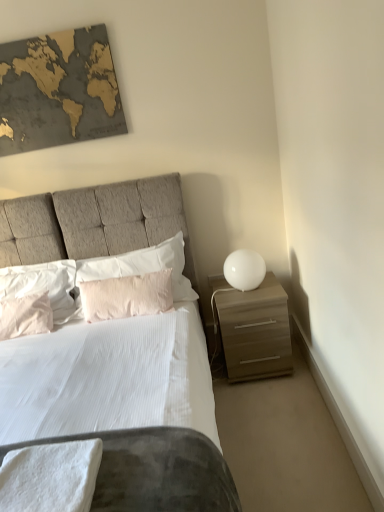
Describe the element at coordinates (98, 221) in the screenshot. The image size is (384, 512). I see `white fabric bed at center` at that location.

Locate an element on the screen. Image resolution: width=384 pixels, height=512 pixels. gold textured map at upper left is located at coordinates (58, 90).

Describe the element at coordinates (126, 296) in the screenshot. I see `pale pink fabric pillow at center, positioned as the second pillow in right-to-left order` at that location.

Identify the location of pale pink fabric pillow at center, which is counted as the third pillow, starting from the left. (126, 296).

Locate an element on the screen. The width and height of the screenshot is (384, 512). matte brown nightstand at right is located at coordinates (255, 331).

The image size is (384, 512). Find the location of `white soft towel at lower left`. white soft towel at lower left is located at coordinates (50, 477).

The image size is (384, 512). What are the coordinates of `white fabric bed at center` in the screenshot? It's located at (98, 221).

Based on the photo, is pale pink fabric pillow at center, which is counted as the third pillow, starting from the left, outside of pink cotton pillow at left, the first pillow from the left?

Indeed, pale pink fabric pillow at center, which is counted as the third pillow, starting from the left, is completely outside pink cotton pillow at left, the first pillow from the left.

From the image's perspective, which one is positioned higher, pale pink fabric pillow at center, which is counted as the third pillow, starting from the left, or pink cotton pillow at left, the first pillow from the left?

pale pink fabric pillow at center, which is counted as the third pillow, starting from the left, appears higher in the image.

Which object is further away from the camera, pale pink fabric pillow at center, which is counted as the third pillow, starting from the left, or pink cotton pillow at left, the first pillow from the left?

pink cotton pillow at left, the first pillow from the left, is behind.

How many degrees apart are the facing directions of pale pink fabric pillow at center, positioned as the second pillow in right-to-left order, and pink cotton pillow at left, the first pillow from the left?

There is a 12.6-degree angle between the facing directions of pale pink fabric pillow at center, positioned as the second pillow in right-to-left order, and pink cotton pillow at left, the first pillow from the left.

Would you say pink cotton pillow at left, the first pillow from the left, is inside or outside white fabric bed at center?

pink cotton pillow at left, the first pillow from the left, is contained in white fabric bed at center.

From a real-world perspective, is pink cotton pillow at left, the 4th pillow in the right-to-left sequence, located higher than white fabric bed at center?

Actually, pink cotton pillow at left, the 4th pillow in the right-to-left sequence, is physically below white fabric bed at center in the real world.

Which is closer to the camera, [32,316] or [131,183]?

Point [32,316] is positioned closer to the camera compared to point [131,183].

From a real-world perspective, is gold textured map at upper left located beneath pale pink fabric pillow at center, which is counted as the third pillow, starting from the left?

Actually, gold textured map at upper left is physically above pale pink fabric pillow at center, which is counted as the third pillow, starting from the left, in the real world.

Does gold textured map at upper left appear on the left side of pale pink fabric pillow at center, positioned as the second pillow in right-to-left order?

Yes, gold textured map at upper left is to the left of pale pink fabric pillow at center, positioned as the second pillow in right-to-left order.

Where is `the 3rd pillow below the gold textured map at upper left (from the image's perspective)`? Image resolution: width=384 pixels, height=512 pixels. the 3rd pillow below the gold textured map at upper left (from the image's perspective) is located at coordinates (126, 296).

Can we say gold textured map at upper left lies outside pale pink fabric pillow at center, positioned as the second pillow in right-to-left order?

Result: Absolutely, gold textured map at upper left is external to pale pink fabric pillow at center, positioned as the second pillow in right-to-left order.

Considering the relative positions of pink cotton pillow at left, the 4th pillow in the right-to-left sequence, and white glossy sphere at right in the image provided, is pink cotton pillow at left, the 4th pillow in the right-to-left sequence, to the right of white glossy sphere at right from the viewer's perspective?

Incorrect, pink cotton pillow at left, the 4th pillow in the right-to-left sequence, is not on the right side of white glossy sphere at right.

From a real-world perspective, which is physically below, pink cotton pillow at left, the 4th pillow in the right-to-left sequence, or white glossy sphere at right?

In real-world perspective, pink cotton pillow at left, the 4th pillow in the right-to-left sequence, is lower.

Based on their sizes in the image, would you say pink cotton pillow at left, the first pillow from the left, is bigger or smaller than white glossy sphere at right?

Considering their sizes, pink cotton pillow at left, the first pillow from the left, takes up more space than white glossy sphere at right.

From a real-world perspective, between pale pink fabric pillow at center, which is counted as the third pillow, starting from the left, and white soft pillow at upper left, the 2th pillow from the left, who is vertically lower?

In real-world perspective, pale pink fabric pillow at center, which is counted as the third pillow, starting from the left, is lower.

Do you think pale pink fabric pillow at center, positioned as the second pillow in right-to-left order, is within white soft pillow at upper left, the third pillow positioned from the right, or outside of it?

pale pink fabric pillow at center, positioned as the second pillow in right-to-left order, is outside white soft pillow at upper left, the third pillow positioned from the right.

The image size is (384, 512). In order to click on pillow that is the 1st object located above the pale pink fabric pillow at center, which is counted as the third pillow, starting from the left (from the image's perspective) in this screenshot , I will do tap(44, 286).

From the image's perspective, is pale pink fabric pillow at center, which is counted as the third pillow, starting from the left, below white soft pillow at upper left, the 2th pillow from the left?

Indeed, from the image's perspective, pale pink fabric pillow at center, which is counted as the third pillow, starting from the left, is shown beneath white soft pillow at upper left, the 2th pillow from the left.

From the image's perspective, is white glossy sphere at right located above or below matte brown nightstand at right?

white glossy sphere at right is above matte brown nightstand at right.

Are white glossy sphere at right and matte brown nightstand at right making contact?

white glossy sphere at right and matte brown nightstand at right are clearly separated.

Between white glossy sphere at right and matte brown nightstand at right, which one has less height?

white glossy sphere at right is shorter.

Which object is wider, white glossy sphere at right or matte brown nightstand at right?

With larger width is matte brown nightstand at right.

Is pink cotton pillow at left, the 4th pillow in the right-to-left sequence, further to the viewer compared to white soft pillow at upper left, the 2th pillow from the left?

No, it is in front of white soft pillow at upper left, the 2th pillow from the left.

From the image's perspective, is pink cotton pillow at left, the 4th pillow in the right-to-left sequence, above white soft pillow at upper left, the 2th pillow from the left?

No, from the image's perspective, pink cotton pillow at left, the 4th pillow in the right-to-left sequence, is not above white soft pillow at upper left, the 2th pillow from the left.

Between point (34, 304) and point (0, 295), which one is positioned in front?

The point (34, 304) is closer to the camera.

Considering the relative sizes of pink cotton pillow at left, the 4th pillow in the right-to-left sequence, and white soft pillow at upper left, the third pillow positioned from the right, in the image provided, is pink cotton pillow at left, the 4th pillow in the right-to-left sequence, wider than white soft pillow at upper left, the third pillow positioned from the right,?

In fact, pink cotton pillow at left, the 4th pillow in the right-to-left sequence, might be narrower than white soft pillow at upper left, the third pillow positioned from the right.

You are a GUI agent. You are given a task and a screenshot of the screen. Output one action in this format:
    pyautogui.click(x=<x>, y=<y>)
    Task: Click on the pillow located underneath the pale pink fabric pillow at center, positioned as the second pillow in right-to-left order (from a real-world perspective)
    The width and height of the screenshot is (384, 512).
    Given the screenshot: What is the action you would take?
    pyautogui.click(x=26, y=316)

Starting from the white fabric bed at center, which pillow is the 2nd one behind? Please provide its 2D coordinates.

[(26, 316)]

Which object lies further to the anchor point white soft pillow at upper left, the 2th pillow from the left, matte brown nightstand at right or gold textured map at upper left?

Based on the image, matte brown nightstand at right appears to be further to white soft pillow at upper left, the 2th pillow from the left.

Based on their spatial positions, is white soft pillow at upper left, the third pillow positioned from the right, or gold textured map at upper left further from pale pink fabric pillow at center, which is counted as the third pillow, starting from the left?

gold textured map at upper left is further to pale pink fabric pillow at center, which is counted as the third pillow, starting from the left.

Based on their spatial positions, is matte brown nightstand at right or gold textured map at upper left further from white soft pillow at center, the 4th pillow when ordered from left to right?

gold textured map at upper left is positioned further to the anchor white soft pillow at center, the 4th pillow when ordered from left to right.

From the image, which object appears to be farther from white soft pillow at center, the 4th pillow when ordered from left to right, white fabric bed at center or white soft pillow at upper left, the 2th pillow from the left?

Based on the image, white soft pillow at upper left, the 2th pillow from the left, appears to be further to white soft pillow at center, the 4th pillow when ordered from left to right.

Which object lies nearer to the anchor point white soft pillow at upper left, the 2th pillow from the left, pink cotton pillow at left, the 4th pillow in the right-to-left sequence, or matte brown nightstand at right?

Based on the image, pink cotton pillow at left, the 4th pillow in the right-to-left sequence, appears to be nearer to white soft pillow at upper left, the 2th pillow from the left.

When comparing their distances from white soft pillow at center, the 4th pillow when ordered from left to right, does white soft pillow at upper left, the third pillow positioned from the right, or white fabric bed at center seem further?

white soft pillow at upper left, the third pillow positioned from the right, is further to white soft pillow at center, the 4th pillow when ordered from left to right.

Based on their spatial positions, is matte brown nightstand at right or white glossy sphere at right closer to white soft pillow at upper left, the third pillow positioned from the right?

matte brown nightstand at right is positioned closer to the anchor white soft pillow at upper left, the third pillow positioned from the right.

Estimate the real-world distances between objects in this image. Which object is further from white soft towel at lower left, white soft pillow at center, the 4th pillow when ordered from left to right, or white soft pillow at upper left, the 2th pillow from the left?

white soft pillow at center, the 4th pillow when ordered from left to right.

Locate an element on the screen. The height and width of the screenshot is (512, 384). nightstand located between white fabric bed at center and pale pink fabric pillow at center, which is counted as the third pillow, starting from the left, in the depth direction is located at coordinates (255, 331).

This screenshot has height=512, width=384. What are the coordinates of `nightstand that lies between gold textured map at upper left and white soft towel at lower left from top to bottom` in the screenshot? It's located at coord(255,331).

At what (x,y) coordinates should I click in order to perform the action: click on nightstand between white fabric bed at center and white soft pillow at upper left, the 2th pillow from the left, in the front-back direction. Please return your answer as a coordinate pair (x, y). The height and width of the screenshot is (512, 384). Looking at the image, I should click on (255, 331).

The width and height of the screenshot is (384, 512). Identify the location of nightstand positioned between white soft towel at lower left and white glossy sphere at right from near to far. (255, 331).